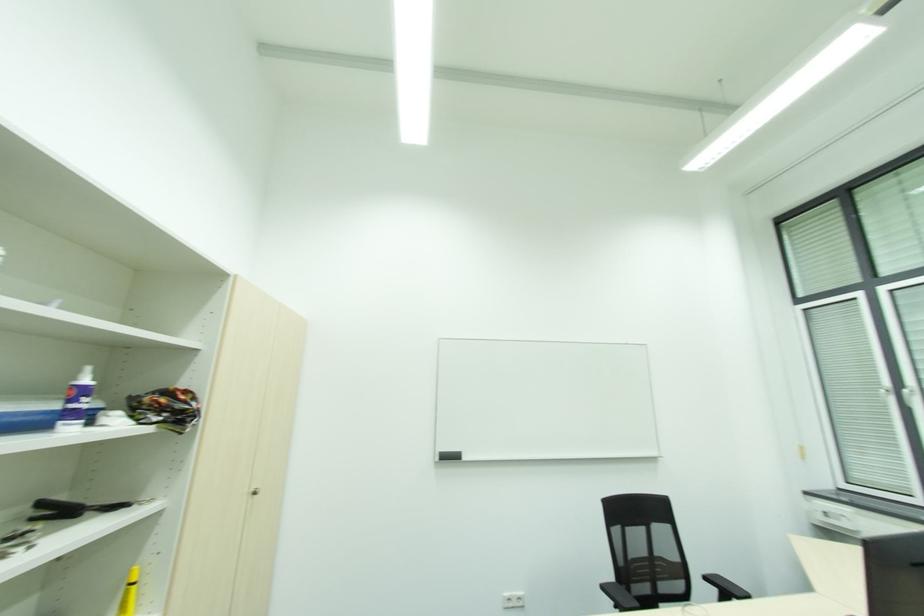
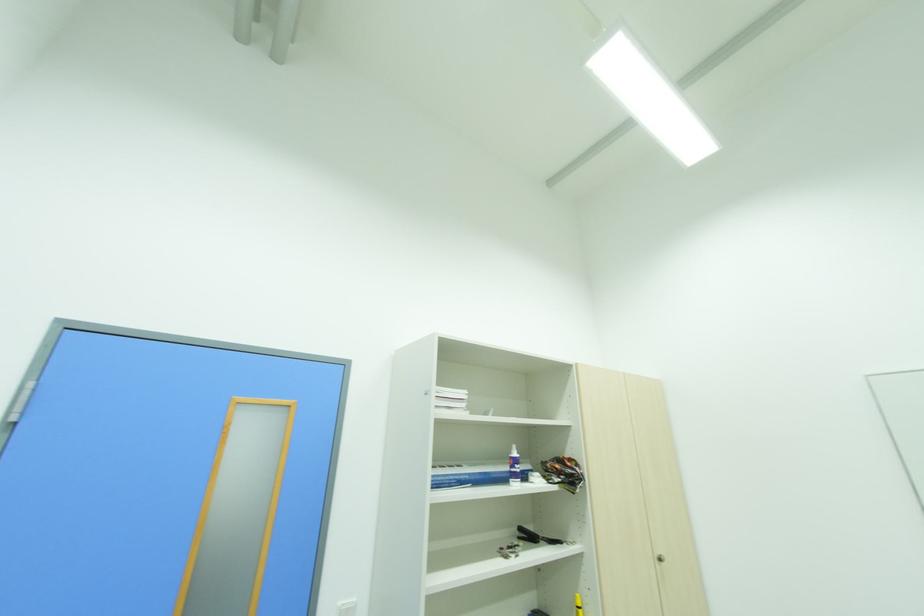
Locate, in the second image, the point that corresponds to (259,493) in the first image.

(663, 561)